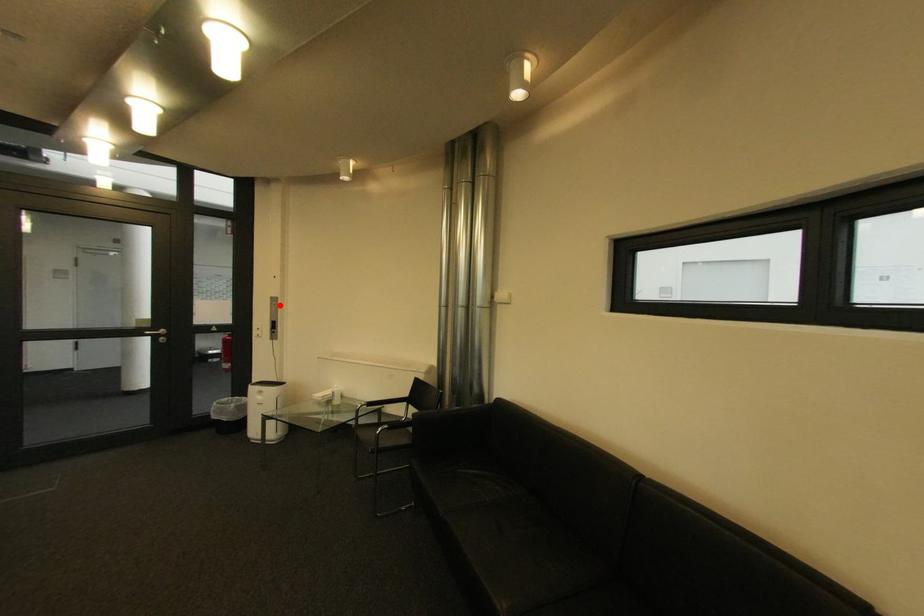
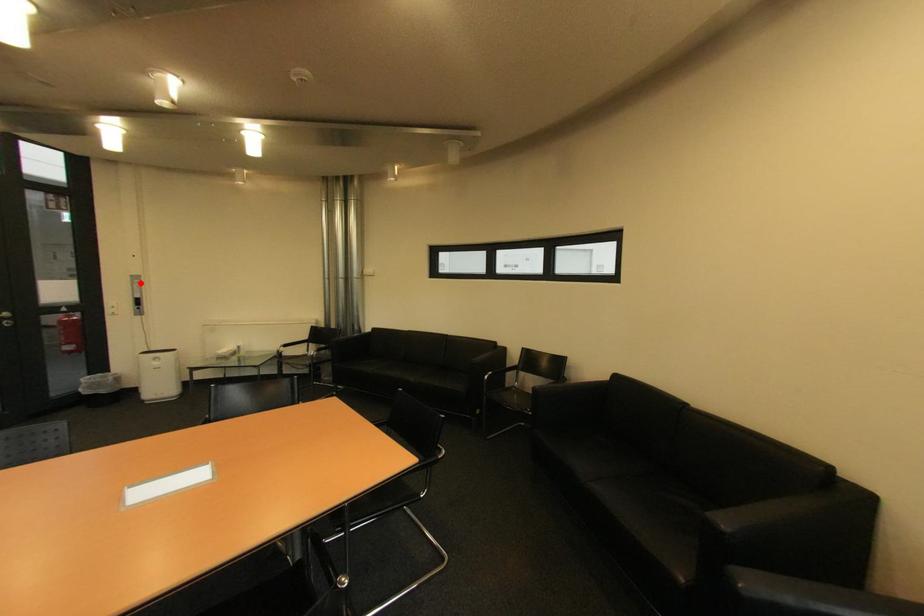
I am providing you with two images of the same scene from different viewpoints. A red point is marked on the first image and another point is marked on the second image. Is the marked point in image1 the same physical position as the marked point in image2?

Yes